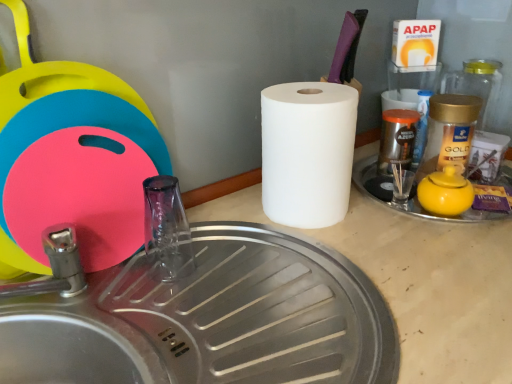
Question: In the image, is yellow matte teapot at right on the left side or the right side of transparent glass faucet at center?

Choices:
 (A) right
 (B) left

Answer: (A)

Question: From the image's perspective, is yellow matte teapot at right above or below transparent glass faucet at center?

Choices:
 (A) above
 (B) below

Answer: (A)

Question: Based on their relative distances, which object is nearer to the brushed metal sink at lower left?

Choices:
 (A) white matte paper towel at center
 (B) yellow matte teapot at right
 (C) transparent glass faucet at center

Answer: (C)

Question: Which is farther from the transparent glass faucet at center?

Choices:
 (A) brushed metal sink at lower left
 (B) white matte paper towel at center
 (C) yellow matte teapot at right

Answer: (C)